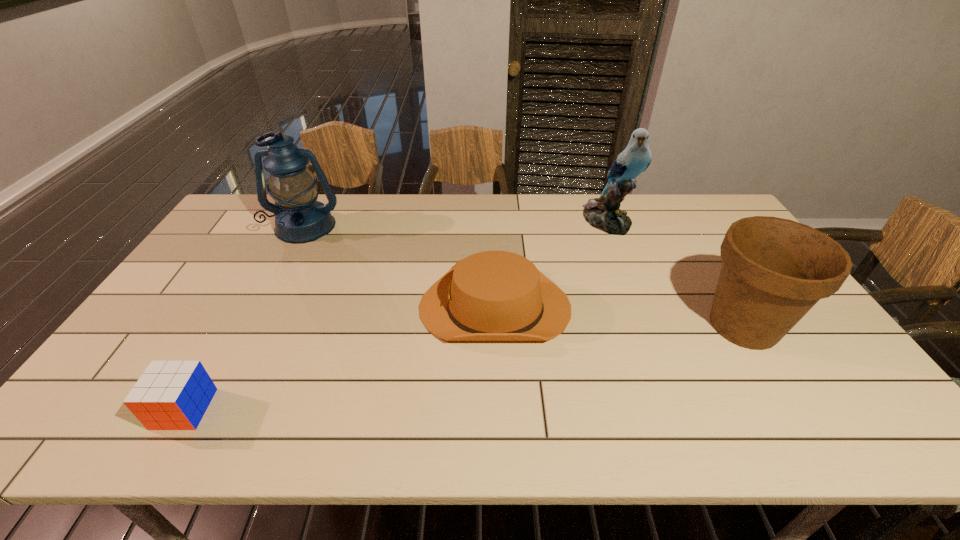
Identify the location of vacant space located 0.110m on the front-facing side of the third object from left to right. (380, 307).

At what (x,y) coordinates should I click in order to perform the action: click on free point located 0.280m on the front-facing side of the third object from left to right. Please return your answer as a coordinate pair (x, y). Looking at the image, I should click on (321, 307).

Where is `free space located on the right of the nearest object`? free space located on the right of the nearest object is located at coordinates (318, 409).

This screenshot has width=960, height=540. Find the location of `parakeet located at the far edge`. parakeet located at the far edge is located at coordinates click(603, 213).

Where is `lantern that is at the far edge`? The width and height of the screenshot is (960, 540). lantern that is at the far edge is located at coordinates (299, 218).

Locate an element on the screen. The image size is (960, 540). object located at the near edge is located at coordinates (170, 395).

This screenshot has height=540, width=960. What are the coordinates of `object at the left edge` in the screenshot? It's located at (299, 218).

Where is `object present at the right edge`? This screenshot has width=960, height=540. object present at the right edge is located at coordinates (774, 270).

Locate an element on the screen. Image resolution: width=960 pixels, height=540 pixels. object located in the far left corner section of the desktop is located at coordinates [x=299, y=218].

Where is `vacant space at the far edge of the desktop`? vacant space at the far edge of the desktop is located at coordinates [x=552, y=207].